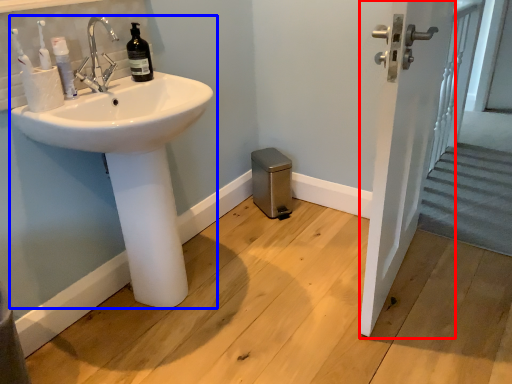
Question: Among these objects, which one is farthest to the camera, screen door (highlighted by a red box) or sink (highlighted by a blue box)?

Choices:
 (A) screen door
 (B) sink

Answer: (B)